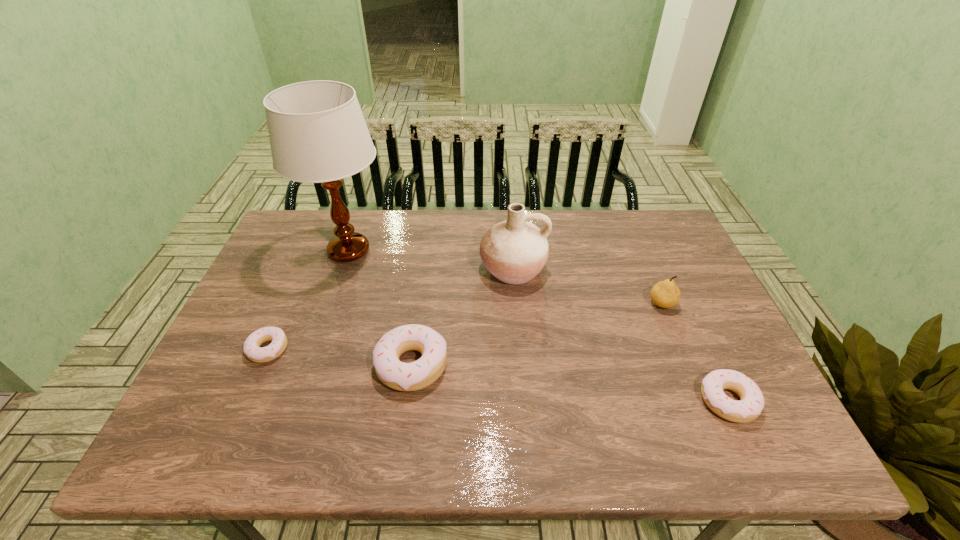
The height and width of the screenshot is (540, 960). In the image, there is a desktop. Identify the location of free space at the far right corner. (658, 246).

Locate an element on the screen. blank region between the fourth object from right to left and the fifth tallest object is located at coordinates (569, 383).

Locate an element on the screen. This screenshot has width=960, height=540. vacant point located between the leftmost doughnut and the second shortest doughnut is located at coordinates (498, 375).

At what (x,y) coordinates should I click in order to perform the action: click on free spot between the pottery and the shortest object. Please return your answer as a coordinate pair (x, y). Looking at the image, I should click on (391, 309).

Find the location of a particular element. The width and height of the screenshot is (960, 540). free space between the fifth shortest object and the third shortest object is located at coordinates (462, 318).

The image size is (960, 540). I want to click on free space between the pottery and the rightmost doughnut, so click(x=620, y=335).

Locate an element on the screen. unoccupied area between the pottery and the shortest object is located at coordinates (391, 309).

This screenshot has width=960, height=540. Identify the location of free area in between the shortest doughnut and the rightmost doughnut. (498, 375).

Find the location of a particular element. This screenshot has height=540, width=960. empty space between the tallest doughnut and the second tallest doughnut is located at coordinates (569, 383).

I want to click on free space that is in between the tallest object and the fourth object from left to right, so click(431, 260).